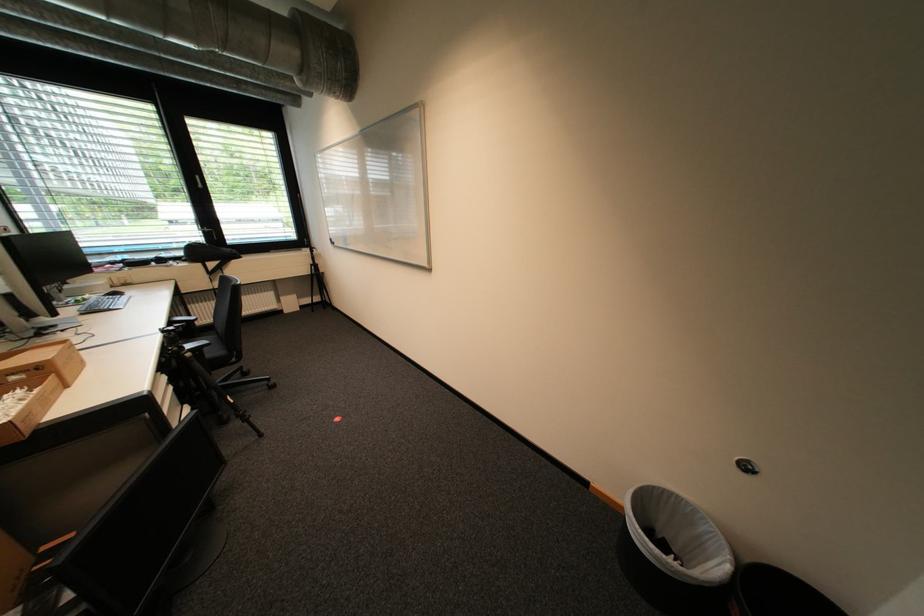
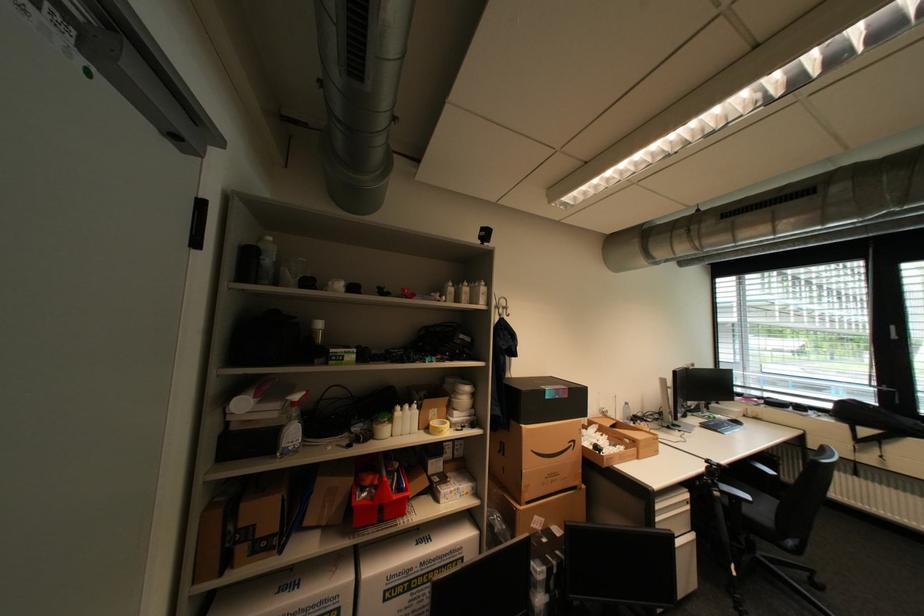
Question: The images are taken continuously from a first-person perspective. In which direction is your viewpoint rotating?

Choices:
 (A) Left
 (B) Right
 (C) Up
 (D) Down

Answer: (A)